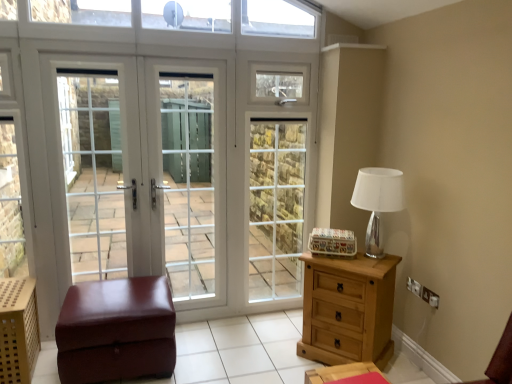
Locate an element on the screen. This screenshot has height=384, width=512. empty space that is ontop of white glass screen door at center, placed as the second screen door when sorted from left to right (from a real-world perspective) is located at coordinates (185, 53).